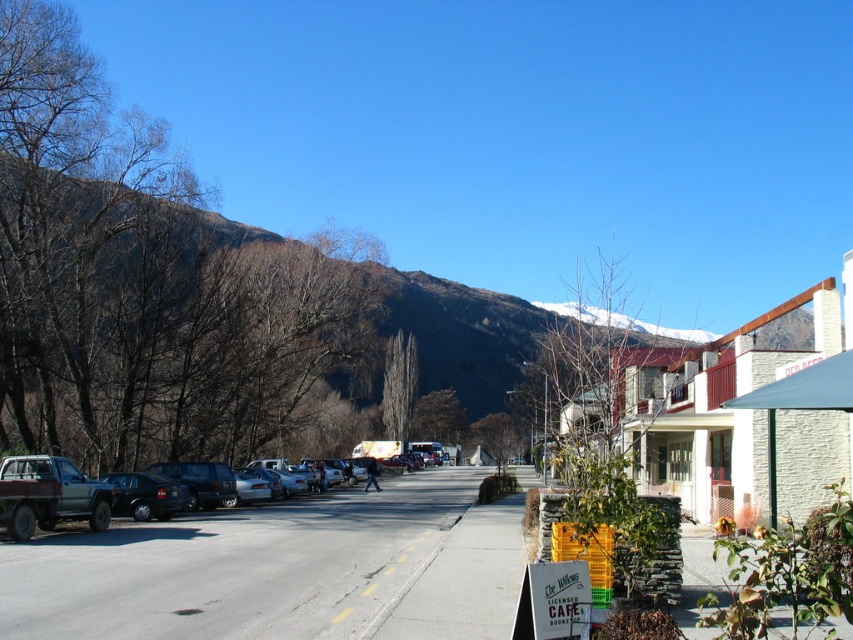
Can you confirm if white stone building at center is wider than rustic wood pickup truck at left?

Correct, the width of white stone building at center exceeds that of rustic wood pickup truck at left.

Between white stone building at center and rustic wood pickup truck at left, which one has more height?

white stone building at center is taller.

Does point (762, 488) lie in front of point (73, 474)?

That is True.

In order to click on white stone building at center in this screenshot , I will do `click(733, 413)`.

The height and width of the screenshot is (640, 853). Describe the element at coordinates (207, 321) in the screenshot. I see `brown textured mountain at upper left` at that location.

Which of these two, brown textured mountain at upper left or white stone building at center, stands taller?

brown textured mountain at upper left

What do you see at coordinates (207, 321) in the screenshot? I see `brown textured mountain at upper left` at bounding box center [207, 321].

Locate an element on the screen. The image size is (853, 640). brown textured mountain at upper left is located at coordinates (207, 321).

Does brown textured mountain at upper left appear over rustic wood pickup truck at left?

Correct, brown textured mountain at upper left is located above rustic wood pickup truck at left.

Does point (27, 340) come closer to viewer compared to point (228, 472)?

Yes, it is.

Identify the location of brown textured mountain at upper left. (207, 321).